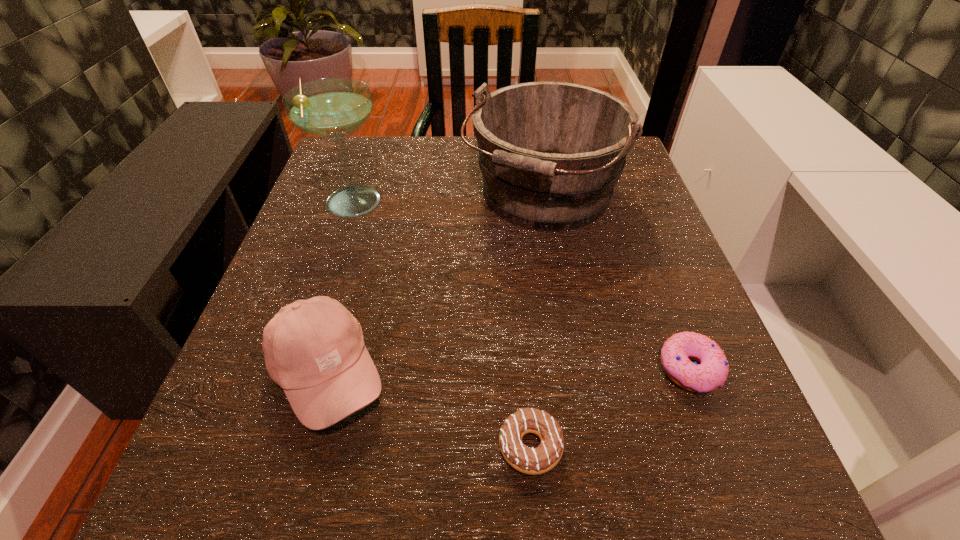
At what (x,y) coordinates should I click in order to perform the action: click on free space that satisfies the following two spatial constraints: 1. on the back side of the martini; 2. on the right side of the fourth shortest object. Please return your answer as a coordinate pair (x, y). Looking at the image, I should click on (355, 196).

The height and width of the screenshot is (540, 960). What are the coordinates of `free space that satisfies the following two spatial constraints: 1. on the front-facing side of the third tallest object; 2. on the right side of the shortest object` in the screenshot? It's located at (308, 446).

I want to click on free location that satisfies the following two spatial constraints: 1. on the front side of the shorter doughnut; 2. on the right side of the tallest object, so click(272, 446).